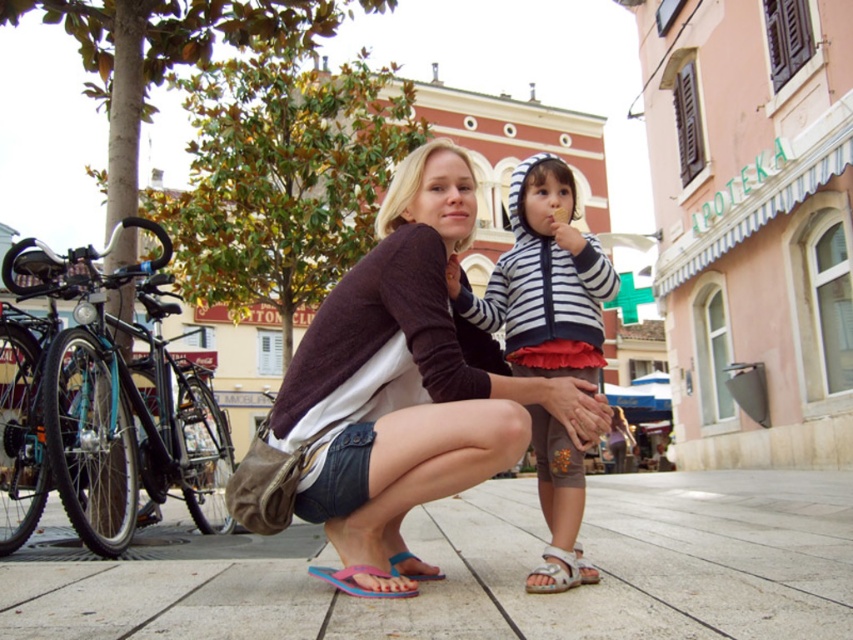
Can you confirm if beige fabric sandal at lower center is wider than blue rubber sandal at lower center?

Indeed, beige fabric sandal at lower center has a greater width compared to blue rubber sandal at lower center.

Locate an element on the screen. This screenshot has height=640, width=853. beige fabric sandal at lower center is located at coordinates click(554, 572).

What do you see at coordinates (554, 572) in the screenshot? I see `beige fabric sandal at lower center` at bounding box center [554, 572].

Between point (547, 586) and point (368, 572), which one is positioned behind?

The point (547, 586) is more distant.

Is point (556, 577) more distant than point (326, 576)?

No.

Locate an element on the screen. beige fabric sandal at lower center is located at coordinates (554, 572).

Describe the element at coordinates (476, 570) in the screenshot. This screenshot has width=853, height=640. I see `smooth concrete pavement at center` at that location.

Is smooth concrete pavement at center bigger than dark purple sweater at center?

Yes, smooth concrete pavement at center is bigger than dark purple sweater at center.

Image resolution: width=853 pixels, height=640 pixels. What do you see at coordinates (476, 570) in the screenshot?
I see `smooth concrete pavement at center` at bounding box center [476, 570].

Image resolution: width=853 pixels, height=640 pixels. In order to click on smooth concrete pavement at center in this screenshot , I will do `click(476, 570)`.